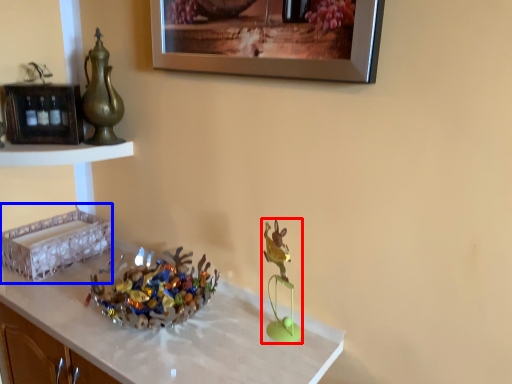
Question: Which object appears closest to the camera in this image, toy (highlighted by a red box) or shelf (highlighted by a blue box)?

Choices:
 (A) toy
 (B) shelf

Answer: (A)